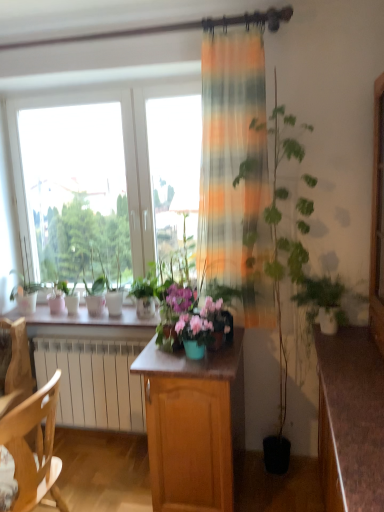
Question: Is white glossy window sill at center wider or thinner than matte plastic flower box at center?

Choices:
 (A) wide
 (B) thin

Answer: (A)

Question: From a real-world perspective, is white glossy window sill at center physically located above or below matte plastic flower box at center?

Choices:
 (A) above
 (B) below

Answer: (B)

Question: Which is farther from the white glossy window sill at center?

Choices:
 (A) wooden cabinet at center
 (B) green matte plant at right
 (C) matte plastic flower box at center
 (D) brown wood desk at lower right
 (E) wooden chair at lower left

Answer: (D)

Question: Estimate the real-world distances between objects in this image. Which object is closer to the white glossy window sill at center?

Choices:
 (A) matte plastic flower box at center
 (B) wooden cabinet at center
 (C) brown wood desk at lower right
 (D) wooden chair at lower left
 (E) green matte plant at right

Answer: (B)